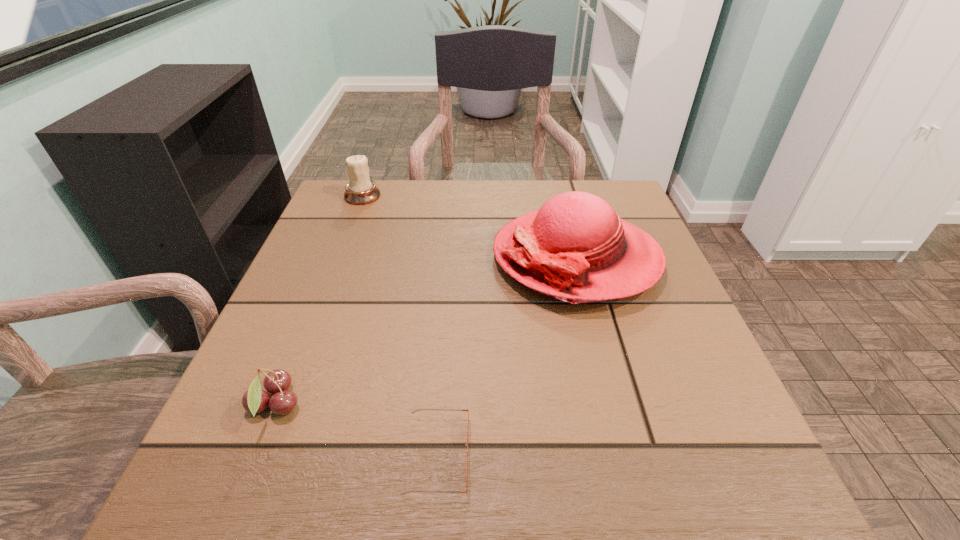
The image size is (960, 540). Find the location of `free space located 0.200m on the front of the second tallest object`. free space located 0.200m on the front of the second tallest object is located at coordinates (340, 254).

You are a GUI agent. You are given a task and a screenshot of the screen. Output one action in this format:
    pyautogui.click(x=<x>, y=<y>)
    Task: Click on the vacant area situated on the leaves of the second shortest object
    The width and height of the screenshot is (960, 540).
    Given the screenshot: What is the action you would take?
    pyautogui.click(x=386, y=405)

This screenshot has width=960, height=540. In order to click on vacant space located 0.370m on the face of the shortest object in this screenshot , I will do `click(732, 455)`.

Locate an element on the screen. hat at the far edge is located at coordinates (575, 248).

The width and height of the screenshot is (960, 540). What are the coordinates of `candle holder positioned at the far edge` in the screenshot? It's located at [360, 190].

Locate an element on the screen. The height and width of the screenshot is (540, 960). object present at the near edge is located at coordinates (404, 493).

This screenshot has width=960, height=540. Find the location of `candle holder at the left edge`. candle holder at the left edge is located at coordinates (360, 190).

Find the location of a particular element. The width and height of the screenshot is (960, 540). cherry present at the left edge is located at coordinates (255, 400).

Identify the location of object that is positioned at the right edge. This screenshot has width=960, height=540. (575, 248).

Image resolution: width=960 pixels, height=540 pixels. In order to click on object located at the far left corner in this screenshot , I will do `click(360, 190)`.